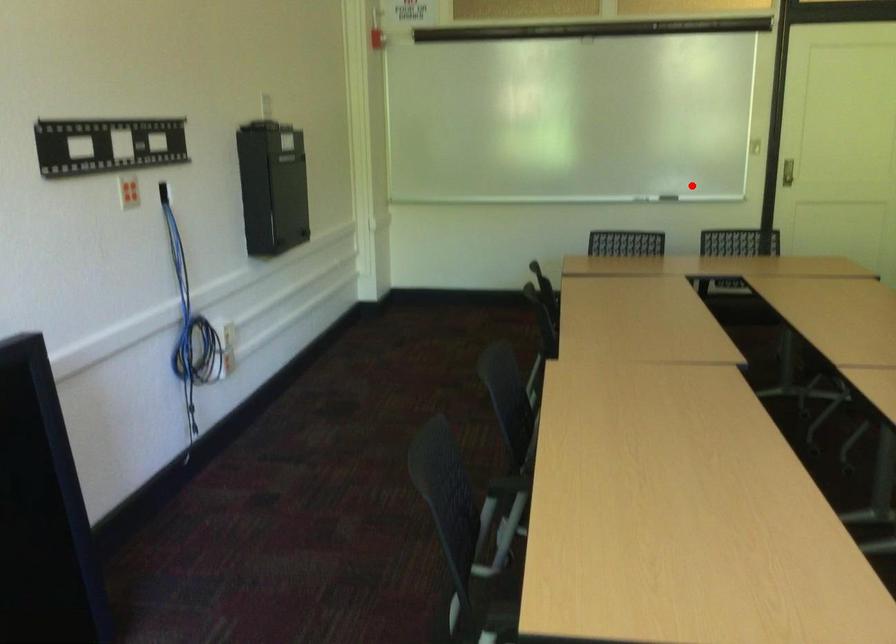
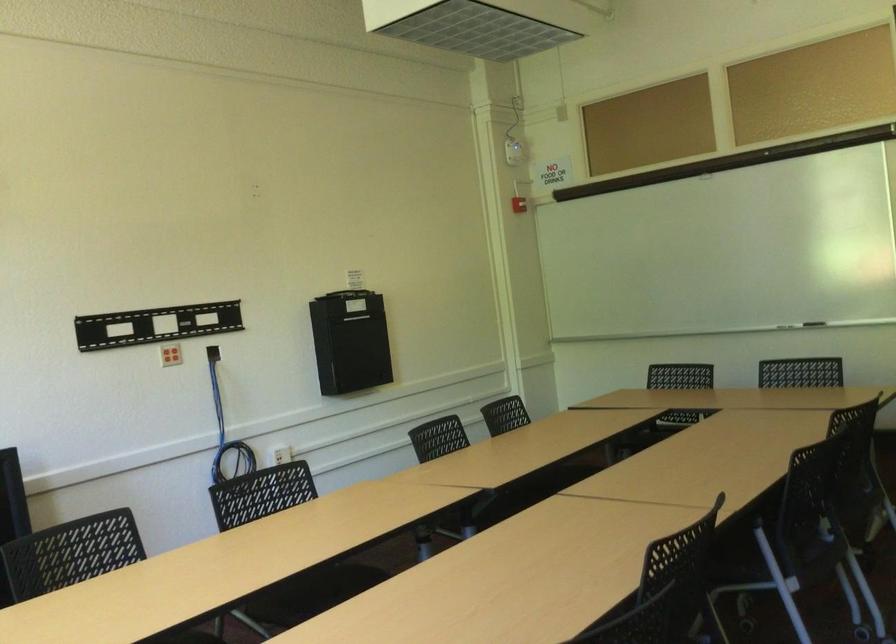
Locate, in the second image, the point that corresponds to the highlighted location in the first image.

(814, 323)